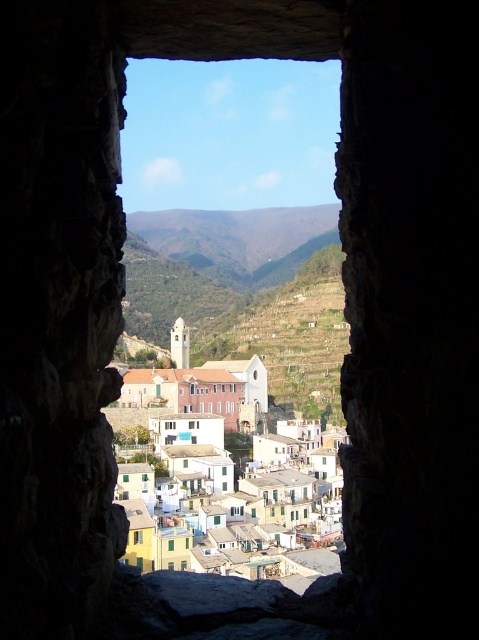
Between green grassy hillside at center and white matte window at center, which one is positioned lower?

white matte window at center is below.

Looking at this image, is green grassy hillside at center shorter than white matte window at center?

No.

Which is in front, point (244, 232) or point (227, 483)?

Point (227, 483)

Where is `green grassy hillside at center`? The width and height of the screenshot is (479, 640). green grassy hillside at center is located at coordinates (239, 241).

Can you confirm if green matte window at center is positioned below brown wooden window at center?

Correct, green matte window at center is located below brown wooden window at center.

Locate an element on the screen. The height and width of the screenshot is (640, 479). green matte window at center is located at coordinates (171, 545).

Which is behind, point (275, 228) or point (231, 388)?

The point (275, 228) is behind.

I want to click on green grassy hillside at center, so click(x=239, y=241).